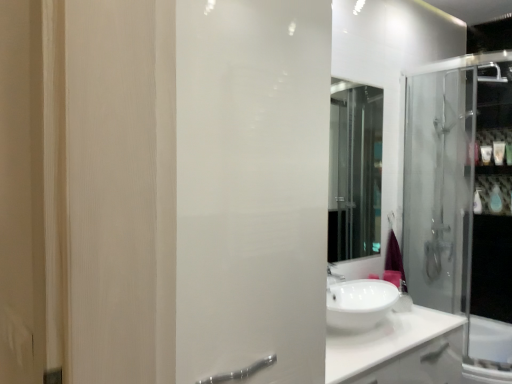
Question: From the image's perspective, is transparent glass shower door at right located above or below white glossy counter top at center?

Choices:
 (A) above
 (B) below

Answer: (A)

Question: From a real-world perspective, is transparent glass shower door at right positioned above or below white glossy counter top at center?

Choices:
 (A) below
 (B) above

Answer: (B)

Question: Considering the real-world distances, which object is closest to the white glossy bottle at upper right, the first toiletry when ordered from top to bottom?

Choices:
 (A) white glossy toothpaste tube at upper right, acting as the second toiletry starting from the top
 (B) blue glossy soap at upper right, which appears as the 2th toiletry when ordered from the bottom
 (C) white frosted glass screen door at center
 (D) white glossy counter top at center
 (E) transparent glass shower door at right

Answer: (A)

Question: Which object is the farthest from the blue glossy soap at upper right, marked as the 4th toiletry in a top-to-bottom arrangement?

Choices:
 (A) white glossy toothpaste tube at upper right, which ranks as the fourth toiletry in bottom-to-top order
 (B) white glossy bottle at upper right, the first toiletry when ordered from top to bottom
 (C) white frosted glass screen door at center
 (D) white glossy soap at upper right, acting as the 3th toiletry starting from the bottom
 (E) white glossy bottle at right, which ranks as the first toiletry in bottom-to-top order

Answer: (C)